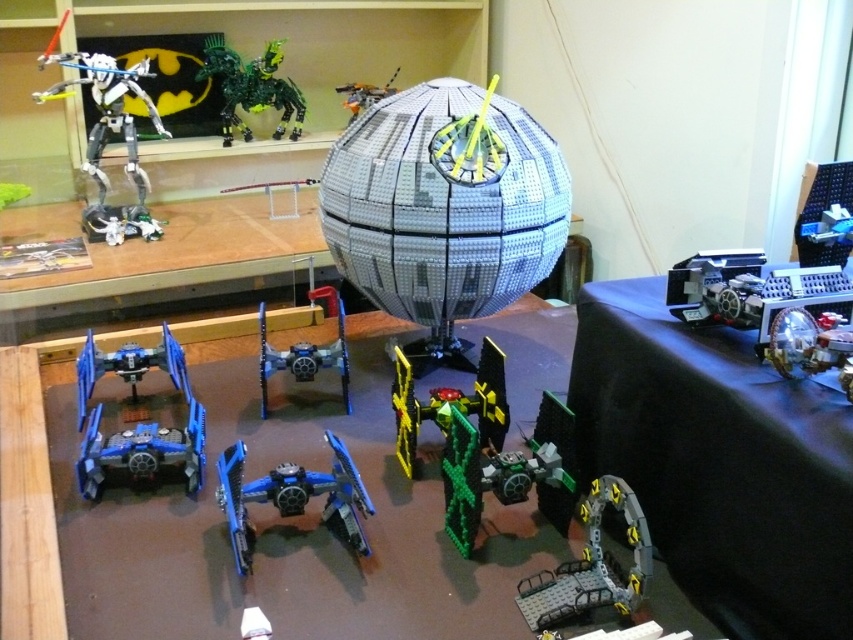
You are a photographer setting up a shot of the LEGO models. You want to ensure the blue plastic spaceship at center is in focus. Given that your camera focuses on the point at coordinates [292,497], will this point align with the blue plastic spaceship at center?

Yes, the point at coordinates [292,497] corresponds to the blue plastic spaceship at center, so focusing there will ensure it is in focus.

You are an astronaut trying to choose a spacecraft to travel to the moon. You have two options in front of you on the table and shelf. Which spacecraft, the blue plastic spaceship at center or the metallic silver spaceship at upper center, has a larger width and would provide more space for your journey?

The blue plastic spaceship at center is wider than the metallic silver spaceship at upper center, so it would provide more space for your journey.

You are a LEGO enthusiast who wants to compare the sizes of the robots displayed on the shelf. Which one is larger between the matte black robot at left and the green metallic robot at upper center?

The matte black robot at left is bigger than the green metallic robot at upper center.